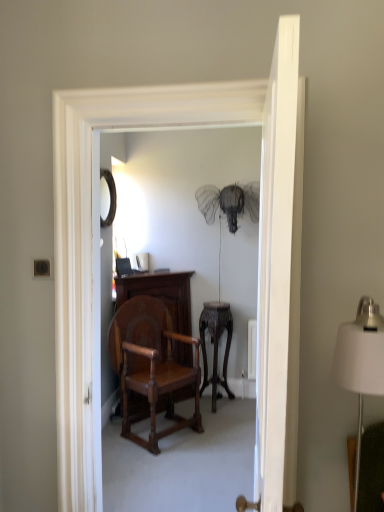
Locate an element on the screen. free space in front of dark wood side table at center is located at coordinates (222, 416).